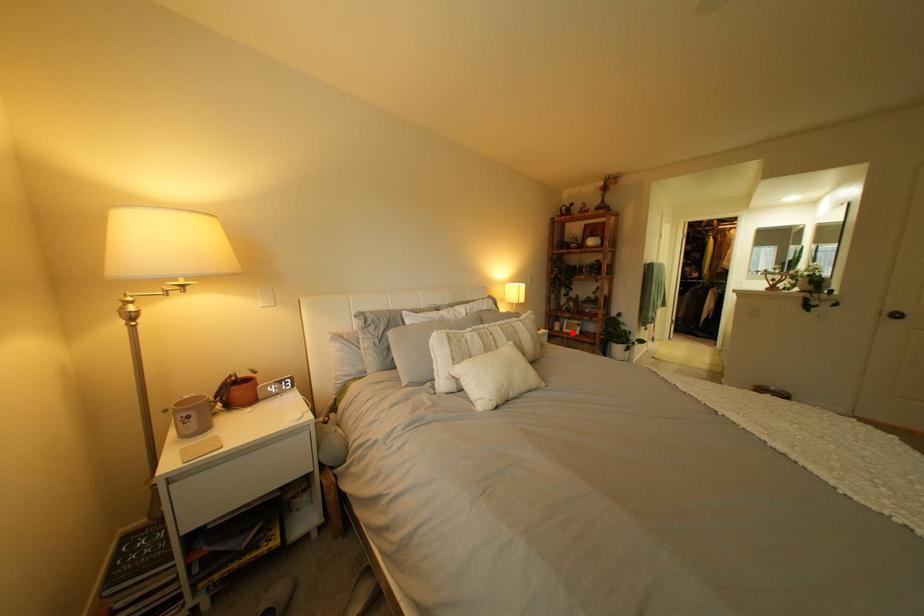
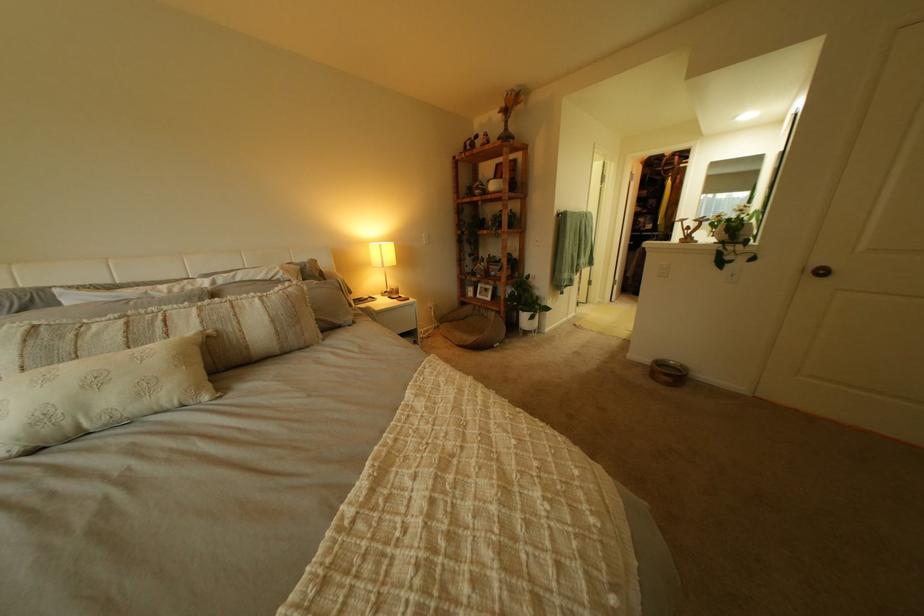
Locate, in the second image, the point that corresponds to the highlighted location in the first image.

(485, 300)